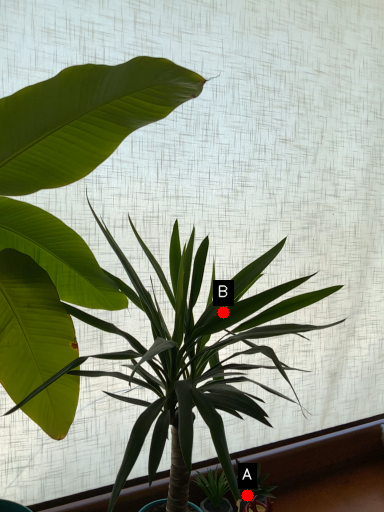
Question: Two points are circled on the image, labeled by A and B beside each circle. Which point appears farthest from the camera in this image?

Choices:
 (A) A is further
 (B) B is further

Answer: (A)